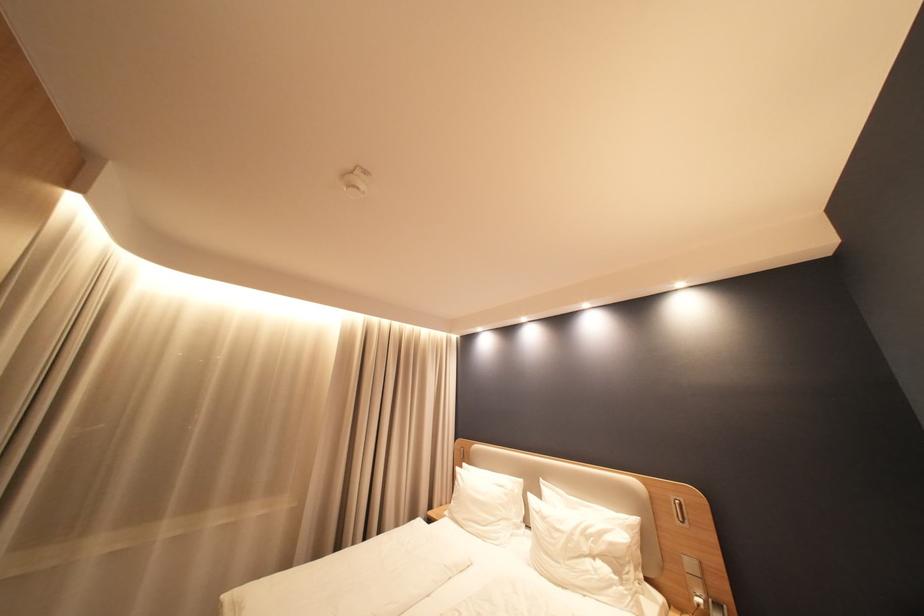
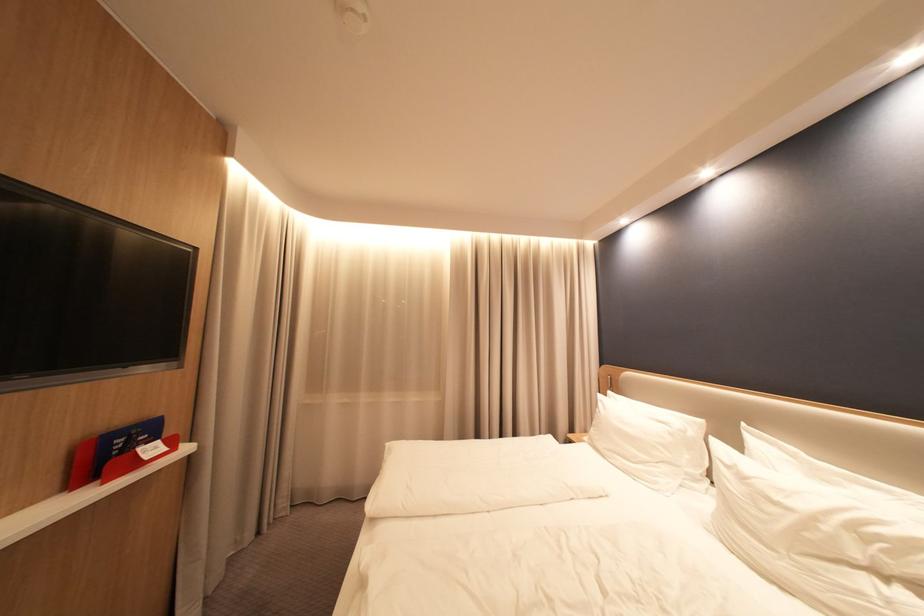
In the second image, find the point that corresponds to pixel 546 511 in the first image.

(737, 464)